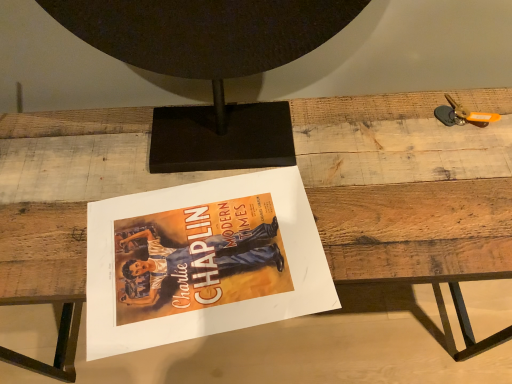
Locate an element on the screen. The image size is (512, 384). vacant region to the left of matte black round table at center is located at coordinates (78, 183).